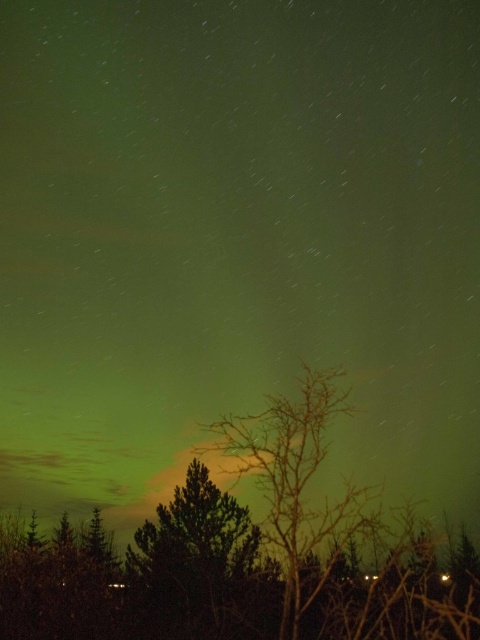
You are standing in a snowy forest under the Northern Lights. You see a green leafless tree at center and a green leafy tree at center. If you want to place a small decorative light between them, how far apart should you position them?

The green leafless tree at center is 1.14 meters away from the green leafy tree at center, so you should position the small decorative light between them at a distance of 1.14 meters apart.

You are standing in a forest under the Northern Lights. You notice a point in the sky marked at coordinates (244, 556). What object is located exactly at that point?

The green leafless tree at center is located exactly at point (244, 556).

You are a photographer standing at the center of a clearing in the forest. You want to capture the Northern Lights with the green leafless tree at center in the frame. Based on the coordinates provided, where should you position the tree in your camera viewfinder to ensure it aligns perfectly with the Northern Lights?

The green leafless tree at center is located at coordinates point (244, 556), so you should position it at that point in your camera viewfinder to ensure it aligns perfectly with the Northern Lights.